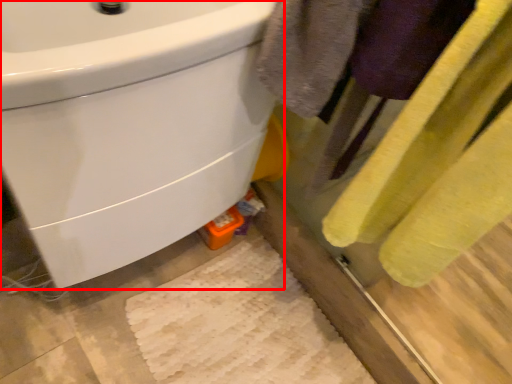
Question: Where is sink (annotated by the red box) located in relation to bath towel in the image?

Choices:
 (A) left
 (B) right

Answer: (A)